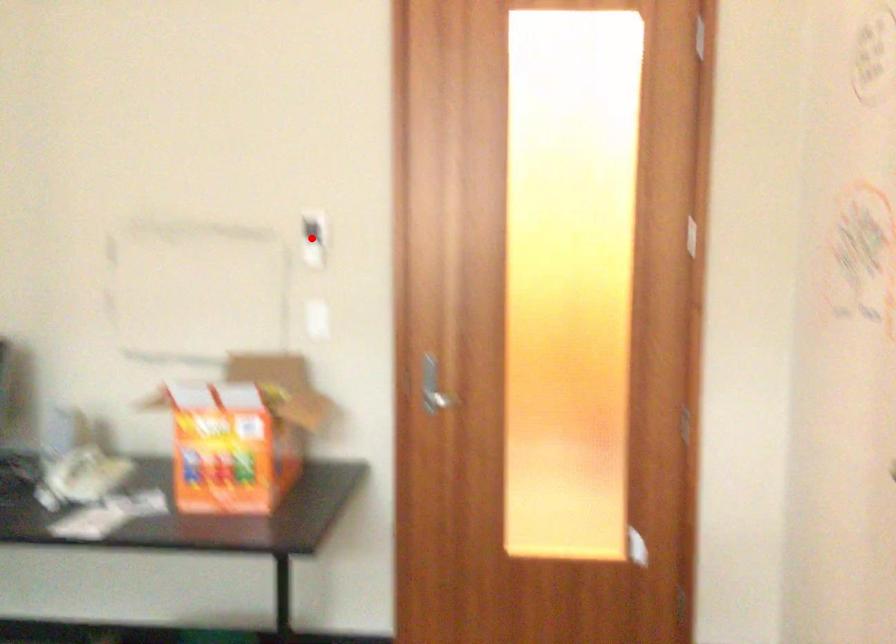
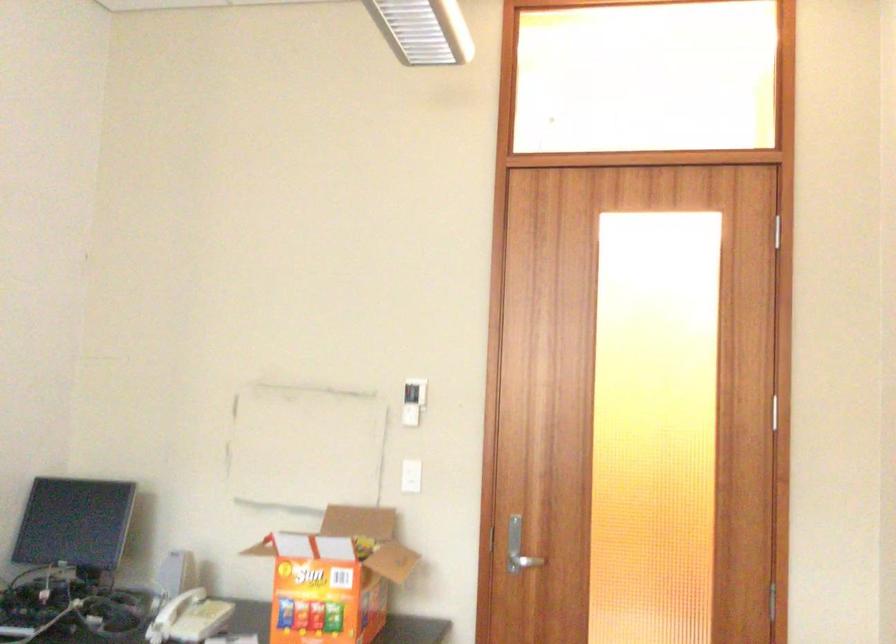
Locate, in the second image, the point that corresponds to the highlighted location in the first image.

(412, 401)